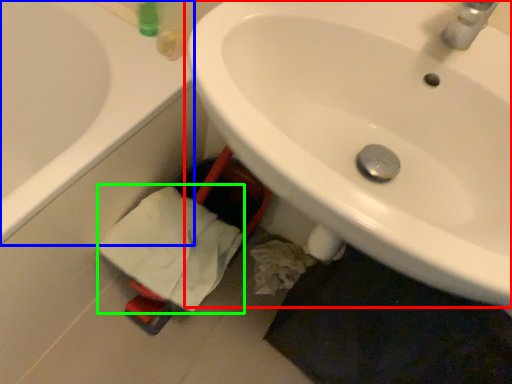
Question: Which is farther away from sink (highlighted by a red box)? bathtub (highlighted by a blue box) or bath towel (highlighted by a green box)?

Choices:
 (A) bathtub
 (B) bath towel

Answer: (A)